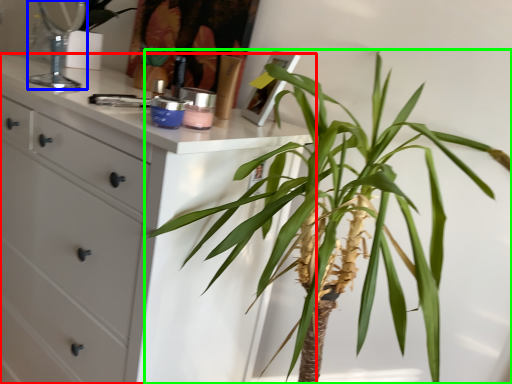
Question: Which object is positioned closest to chest of drawers (highlighted by a red box)? Select from mirror (highlighted by a blue box) and houseplant (highlighted by a green box).

Choices:
 (A) mirror
 (B) houseplant

Answer: (B)